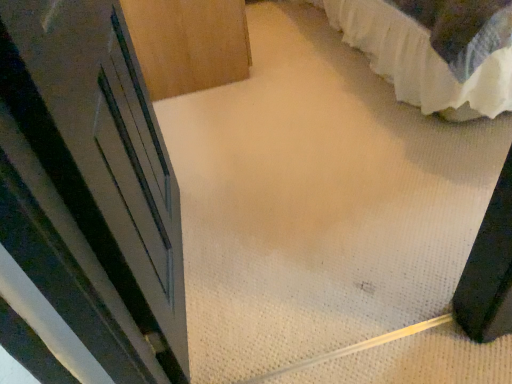
This screenshot has width=512, height=384. I want to click on vacant space behind metallic gray door at left, so click(x=231, y=167).